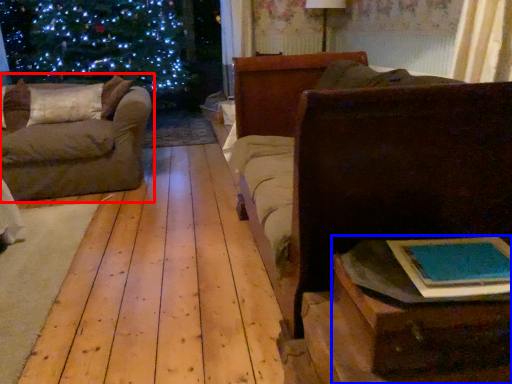
Question: Which point is further to the camera, studio couch (highlighted by a red box) or table (highlighted by a blue box)?

Choices:
 (A) studio couch
 (B) table

Answer: (A)